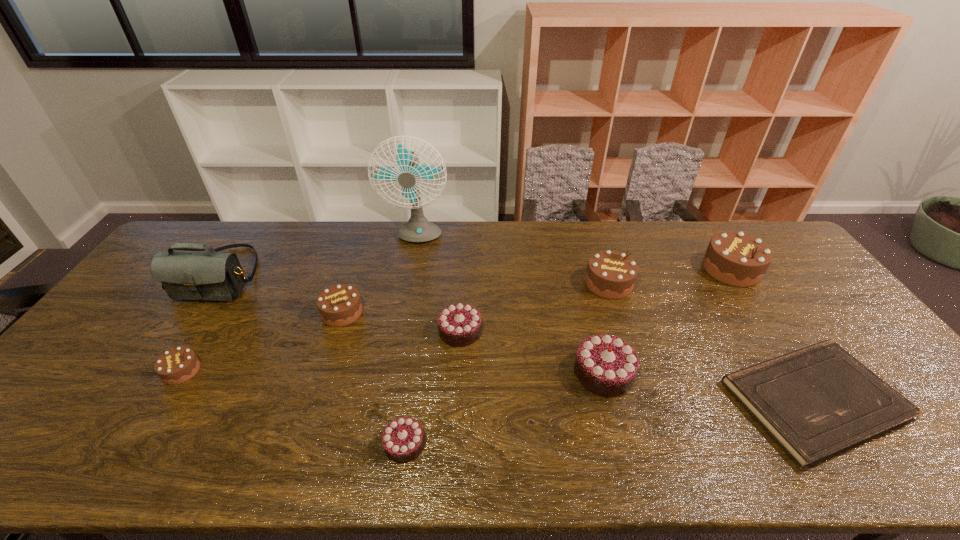
Where is `free region located on the front of the rightmost chocolate cake`? free region located on the front of the rightmost chocolate cake is located at coordinates (756, 306).

At what (x,y) coordinates should I click in order to perform the action: click on vacant point located 0.090m on the right of the second brown chocolate cake from right to left. Please return your answer as a coordinate pair (x, y). The width and height of the screenshot is (960, 540). Looking at the image, I should click on (661, 284).

Find the location of `vacant space located 0.210m on the back of the biggest chocolate chocolate cake`. vacant space located 0.210m on the back of the biggest chocolate chocolate cake is located at coordinates coord(584,296).

Find the location of a particular element. vacant space located 0.060m on the front of the second brown chocolate cake from left to right is located at coordinates (332, 344).

Locate an element on the screen. vacant space located 0.130m on the back of the farthest chocolate chocolate cake is located at coordinates pos(462,286).

I want to click on vacant space situated 0.230m on the right of the nearest brown chocolate cake, so click(289, 371).

What are the coordinates of `vacant region located on the left of the smallest chocolate chocolate cake` in the screenshot? It's located at (241, 444).

You are a GUI agent. You are given a task and a screenshot of the screen. Output one action in this format:
    pyautogui.click(x=<x>, y=<y>)
    Task: Click on the blank space located on the back of the paperback book
    
    Given the screenshot: What is the action you would take?
    pyautogui.click(x=728, y=270)

Where is `fan located at the far edge`? The height and width of the screenshot is (540, 960). fan located at the far edge is located at coordinates (418, 229).

At what (x,y) coordinates should I click in order to perform the action: click on shoulder bag located at the far edge. Please return your answer as a coordinate pair (x, y). Looking at the image, I should click on (218, 276).